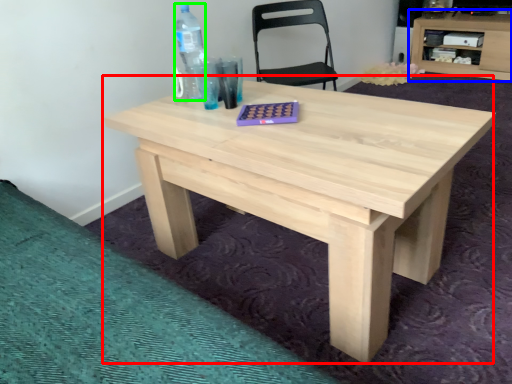
Question: Which is farther away from table (highlighted by a red box)? computer desk (highlighted by a blue box) or bottle (highlighted by a green box)?

Choices:
 (A) computer desk
 (B) bottle

Answer: (A)